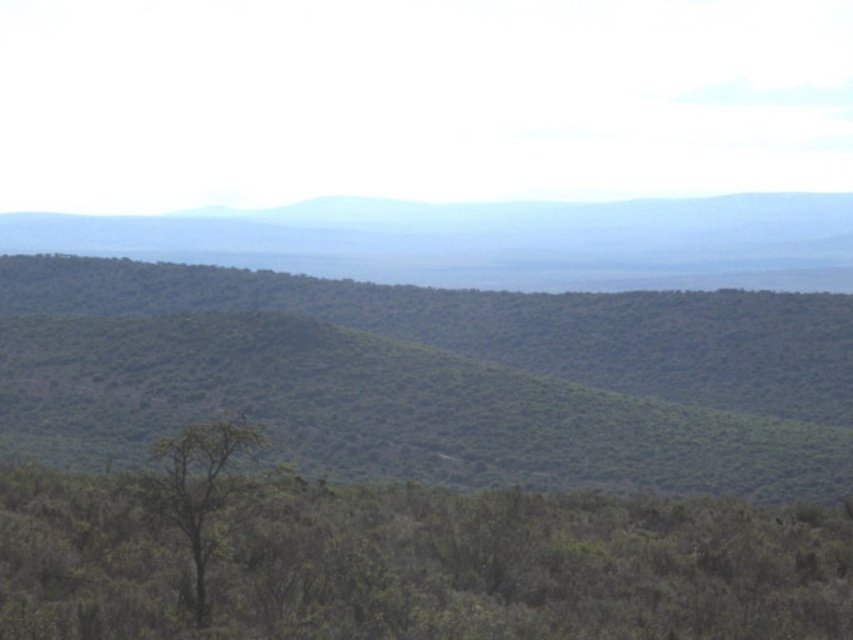
Question: Is green leafy hillside at center to the right of green leafy tree at lower center from the viewer's perspective?

Choices:
 (A) no
 (B) yes

Answer: (B)

Question: Can you confirm if green leafy tree at lower center is positioned to the right of green textured hill at center?

Choices:
 (A) no
 (B) yes

Answer: (B)

Question: Estimate the real-world distances between objects in this image. Which object is farther from the green leafy hillside at center?

Choices:
 (A) green textured hill at center
 (B) green leafy tree at lower center

Answer: (A)

Question: Is green leafy tree at lower center wider than green textured hill at center?

Choices:
 (A) yes
 (B) no

Answer: (B)

Question: Which point is farther to the camera?

Choices:
 (A) (196, 433)
 (B) (424, 241)

Answer: (B)

Question: Which point is farther to the camera?

Choices:
 (A) green leafy tree at lower center
 (B) green leafy hillside at center
 (C) green textured hill at center
 (D) green leafy tree at center

Answer: (C)